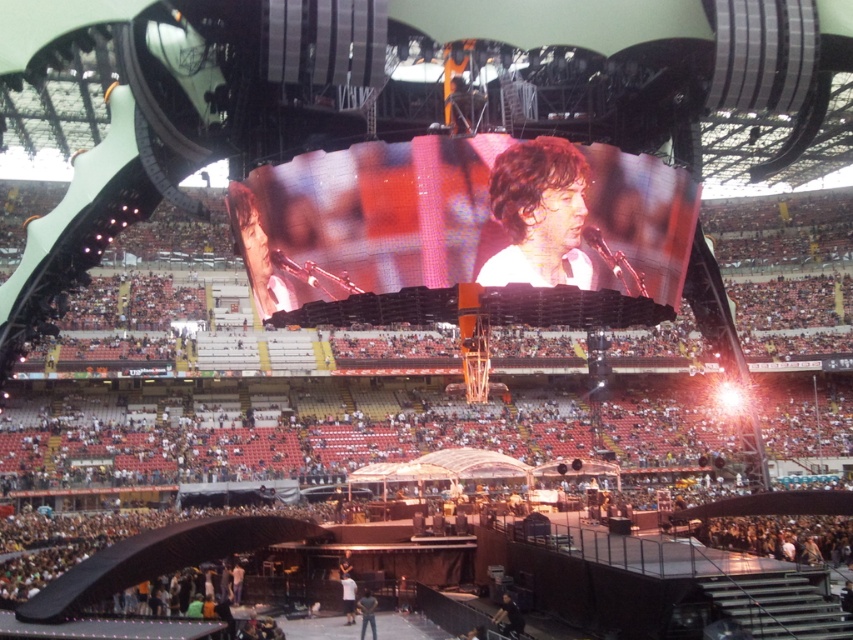
You are a stagehand standing at the point marked as point (514,612) in the stadium. You need to quickly move to the stage entrance located 50 meters away from the viewer. Can you reach the entrance before the next song starts?

The distance between point (514,612) and the viewer is 53.74 meters, which is farther than the 50 meters to the stage entrance. Therefore, you cannot reach the entrance in time.

You are standing at the entrance of the stadium and see the dark brown leather jacket at lower center on the stage. If you want to move from your current position to the jacket, which direction should you walk relative to the stage?

The dark brown leather jacket at lower center is located at point (508,618), which is towards the lower part of the stage. To reach it from the entrance, you should walk towards the lower section of the stage where the jacket is positioned.